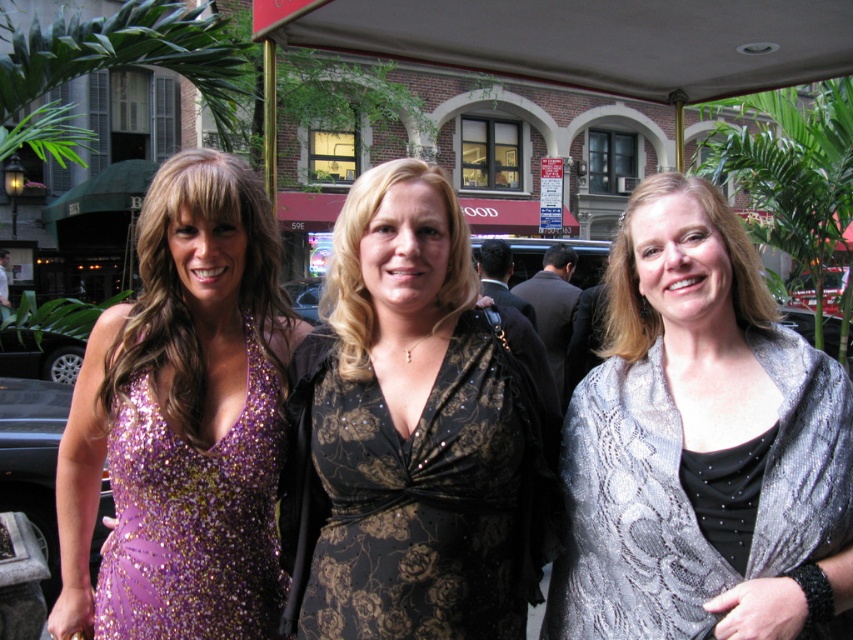
You are a photographer at a formal event. You need to position a spotlight on the silver sequined shawl at center and the lavender sequined dress at left. Based on their positions, which object should you light first if you start from the left side of the image?

The lavender sequined dress at left should be lit first because it is positioned to the left of the silver sequined shawl at center.

You are taking a photo of two points in the image. The first point is at coordinate point(x=676, y=240) and the second is at point(x=155, y=582). Which point will appear larger in your photo?

Point(x=676, y=240) is closer to the camera than point(x=155, y=582), so it will appear larger in the photo.